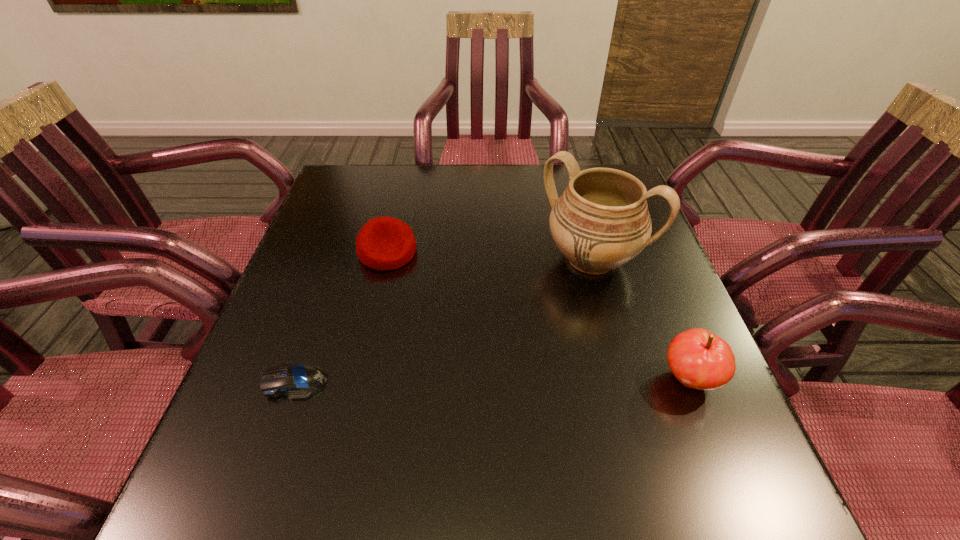
This screenshot has height=540, width=960. I want to click on vacant space on the desktop that is between the computer mouse and the third shortest object and is positioned on the front-facing side of the tallest object, so click(483, 380).

Identify the location of vacant space on the desktop that is between the computer mouse and the second tallest object and is positioned on the seat area of the second shortest object. (505, 380).